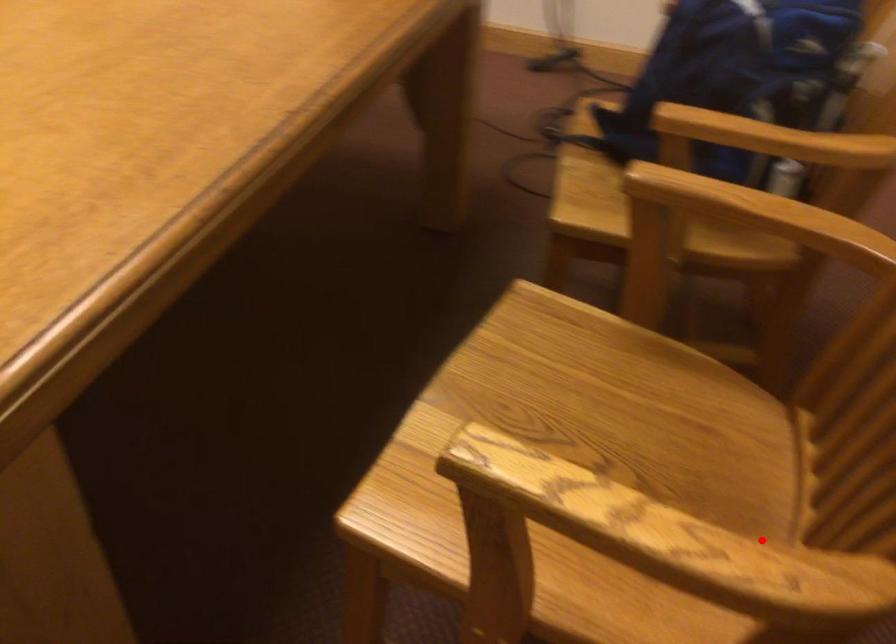
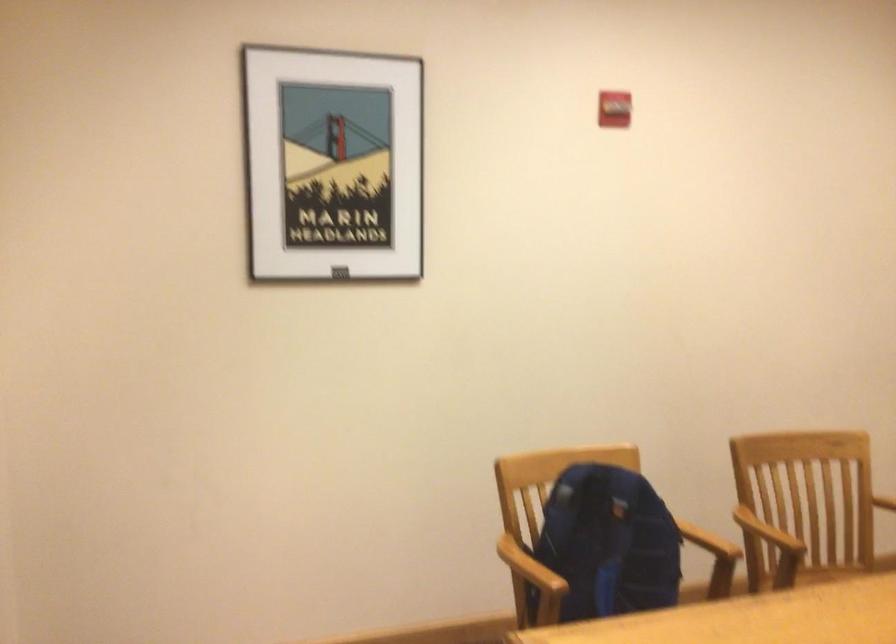
Locate, in the second image, the point that corresponds to the highlighted location in the first image.

(837, 572)